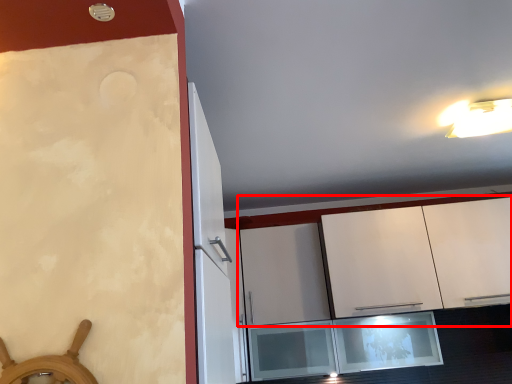
Question: From the image's perspective, what is the correct spatial relationship of cabinetry (annotated by the red box) in relation to light fixture?

Choices:
 (A) below
 (B) above

Answer: (A)